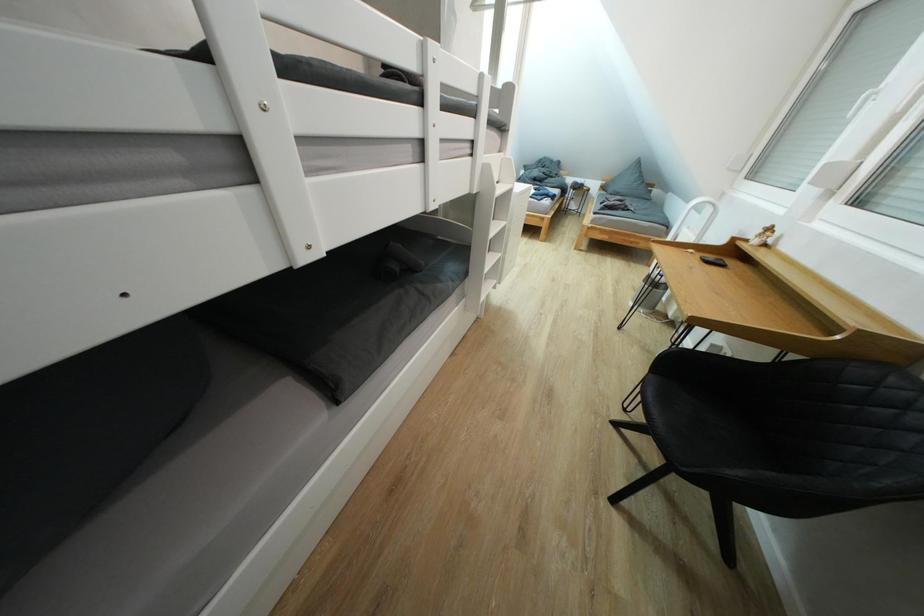
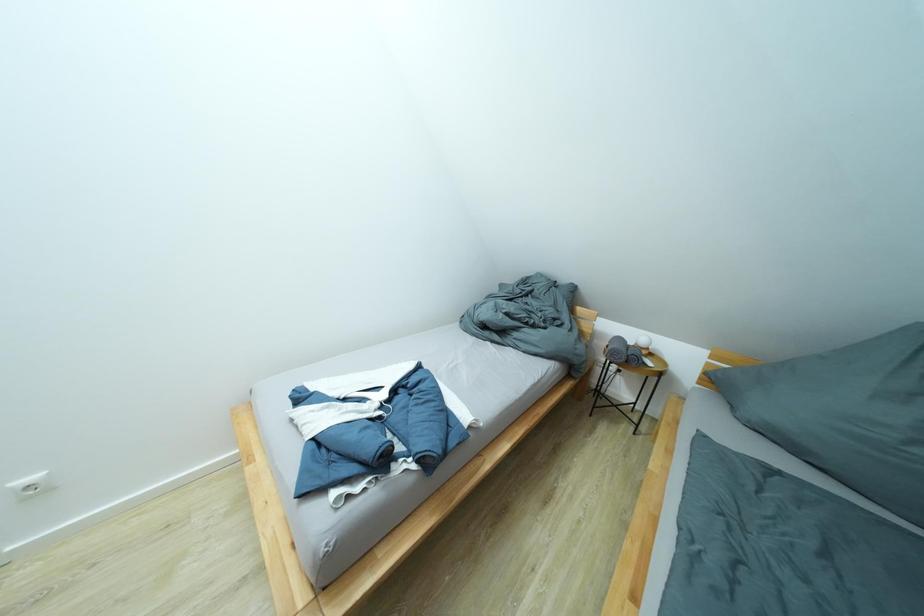
What movement of the cameraman would produce the second image?

The cameraman walked toward right, forward.